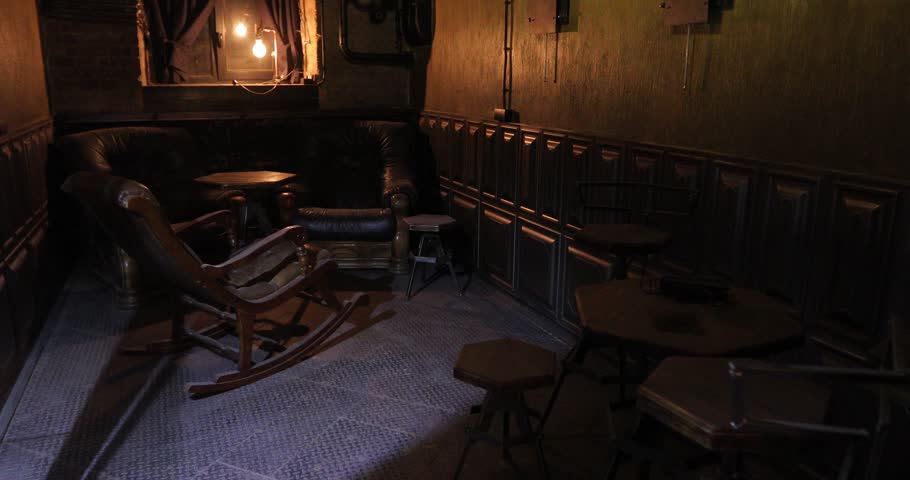
Image resolution: width=910 pixels, height=480 pixels. I want to click on light, so click(258, 54).